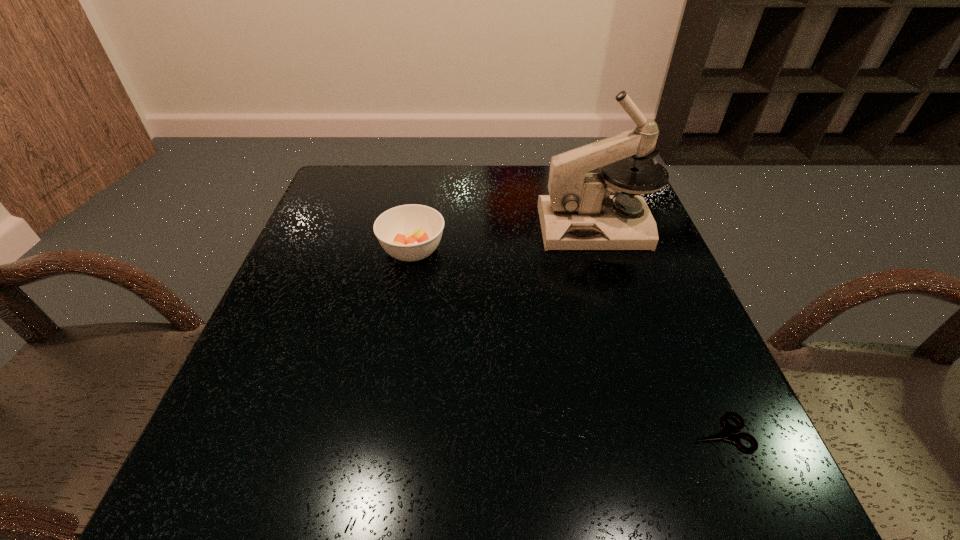
Where is `object present at the far edge`? This screenshot has height=540, width=960. object present at the far edge is located at coordinates (579, 213).

This screenshot has width=960, height=540. Identify the location of object present at the near edge. (725, 433).

Identify the location of microscope that is at the right edge. The width and height of the screenshot is (960, 540). (579, 213).

Identify the location of shears located at the right edge. (725, 433).

Find the location of a particular element. object located at the far right corner is located at coordinates coord(579,213).

Locate an element on the screen. The width and height of the screenshot is (960, 540). object at the near right corner is located at coordinates (725, 433).

Find the location of a particular element. The image size is (960, 540). free space at the far edge of the desktop is located at coordinates [x=468, y=171].

This screenshot has width=960, height=540. What are the coordinates of `vacant space at the near edge of the desktop` in the screenshot? It's located at (432, 464).

Where is `vacant space at the left edge`? vacant space at the left edge is located at coordinates (324, 230).

In order to click on free space at the right edge in this screenshot , I will do `click(650, 261)`.